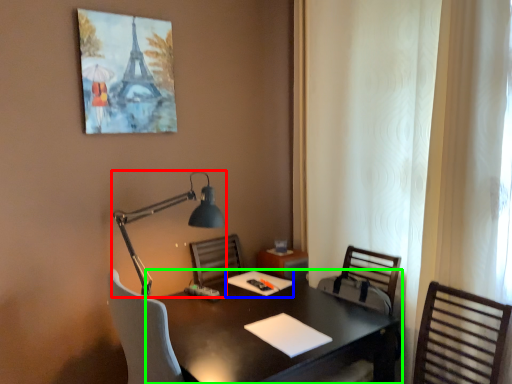
Question: Which is nearer to the lamp (highlighted by a red box)? notepad (highlighted by a blue box) or desk (highlighted by a green box).

Choices:
 (A) notepad
 (B) desk

Answer: (A)